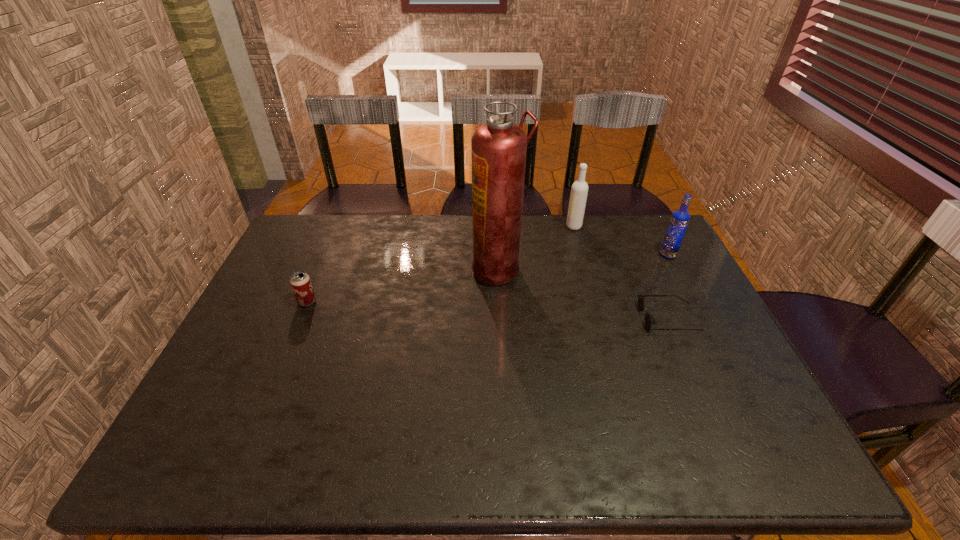
I want to click on vacant space located on the side of the fire extinguisher with the label, so click(x=371, y=269).

This screenshot has height=540, width=960. Identify the location of vacant space situated on the front of the farther vodka. [x=590, y=284].

The width and height of the screenshot is (960, 540). I want to click on free space located on the front of the nearer vodka, so click(x=704, y=323).

Locate an element on the screen. The width and height of the screenshot is (960, 540). vacant region located 0.280m on the right of the beer can is located at coordinates (413, 302).

You are a GUI agent. You are given a task and a screenshot of the screen. Output one action in this format:
    pyautogui.click(x=<x>, y=<y>)
    Task: Click on the free spot located 0.090m on the front-facing side of the sunglasses
    This screenshot has height=540, width=960.
    Given the screenshot: What is the action you would take?
    pyautogui.click(x=610, y=318)

Locate an element on the screen. This screenshot has width=960, height=540. vacant space located 0.080m on the front-facing side of the sunglasses is located at coordinates (612, 318).

Locate an element on the screen. The image size is (960, 540). vacant space located 0.180m on the front-facing side of the sunglasses is located at coordinates click(x=577, y=318).

This screenshot has height=540, width=960. In order to click on fire extinguisher present at the far edge in this screenshot , I will do `click(499, 148)`.

What are the coordinates of `object at the left edge` in the screenshot? It's located at (300, 282).

Locate an element on the screen. This screenshot has height=540, width=960. vodka positioned at the right edge is located at coordinates [680, 218].